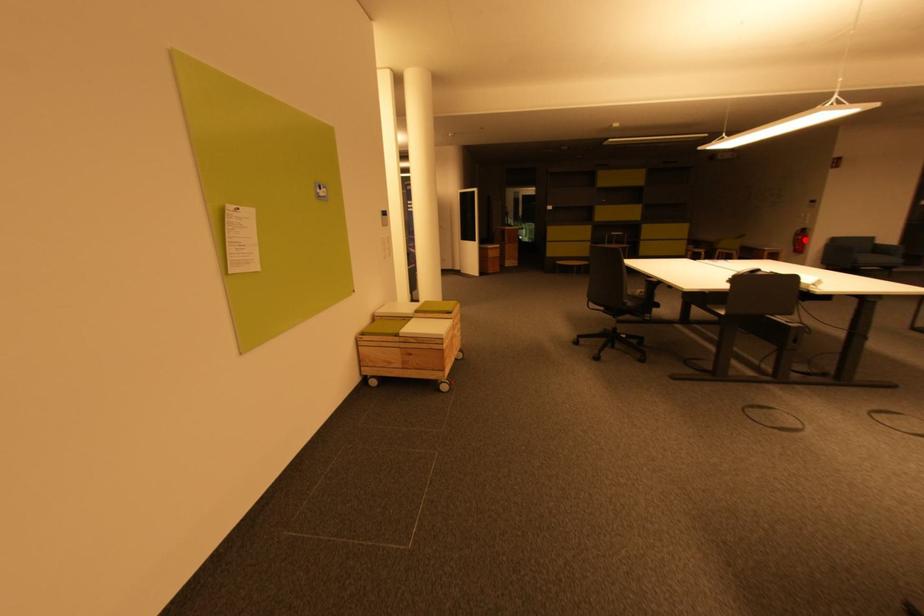
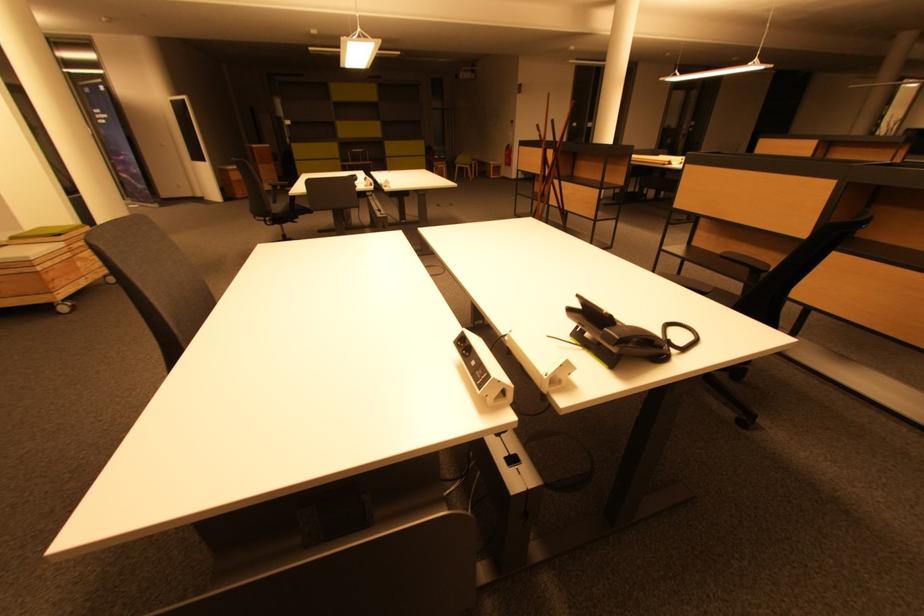
Locate, in the second image, the point that corresponds to the highlighted location in the first image.

(512, 155)